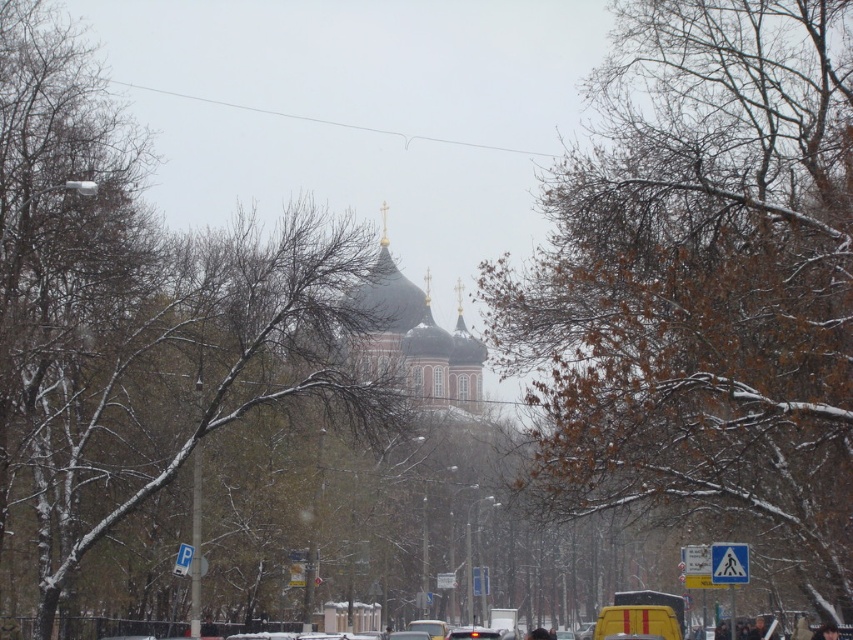
Question: Is brown leafy tree at center bigger than snow-covered branches at center?

Choices:
 (A) no
 (B) yes

Answer: (A)

Question: Does brown leafy tree at center appear on the right side of snow-covered branches at center?

Choices:
 (A) yes
 (B) no

Answer: (A)

Question: Which of the following is the farthest from the observer?

Choices:
 (A) snow-covered branches at center
 (B) brown leafy tree at center

Answer: (A)

Question: Which point appears closest to the camera in this image?

Choices:
 (A) (306, 284)
 (B) (672, 288)

Answer: (B)

Question: Does brown leafy tree at center have a larger size compared to snow-covered branches at center?

Choices:
 (A) yes
 (B) no

Answer: (B)

Question: Which point appears farthest from the camera in this image?

Choices:
 (A) (67, 74)
 (B) (674, 330)

Answer: (A)